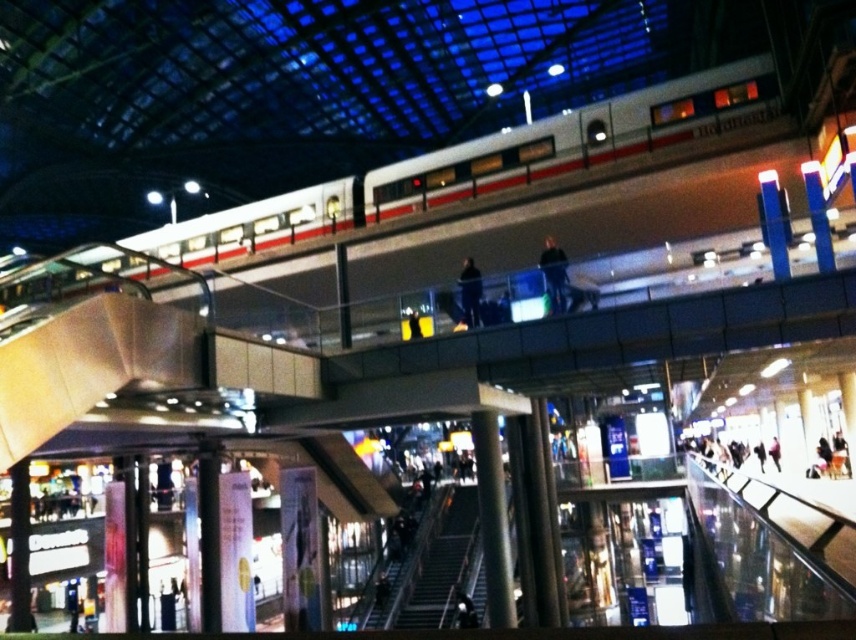
Can you confirm if dark blue fabric jacket at upper center is smaller than dark blue fabric at upper center?

No.

Looking at this image, can you confirm if dark blue fabric jacket at upper center is shorter than dark blue fabric at upper center?

Incorrect, dark blue fabric jacket at upper center's height does not fall short of dark blue fabric at upper center's.

In the scene shown: Who is more distant from viewer, (550, 278) or (467, 317)?

The point (467, 317) is behind.

Identify the location of dark blue fabric jacket at upper center. The height and width of the screenshot is (640, 856). (553, 275).

Is point (688, 96) positioned in front of point (461, 289)?

No, it is behind (461, 289).

Between white glossy train at upper center and dark blue fabric at upper center, which one has more height?

white glossy train at upper center is taller.

This screenshot has height=640, width=856. Identify the location of white glossy train at upper center. (458, 172).

I want to click on white glossy train at upper center, so click(458, 172).

Is white glossy train at upper center positioned in front of dark blue fabric jacket at upper center?

Yes, white glossy train at upper center is in front of dark blue fabric jacket at upper center.

Is white glossy train at upper center wider than dark blue fabric jacket at upper center?

Yes, white glossy train at upper center is wider than dark blue fabric jacket at upper center.

What do you see at coordinates (458, 172) in the screenshot? I see `white glossy train at upper center` at bounding box center [458, 172].

The width and height of the screenshot is (856, 640). In order to click on white glossy train at upper center in this screenshot , I will do `click(458, 172)`.